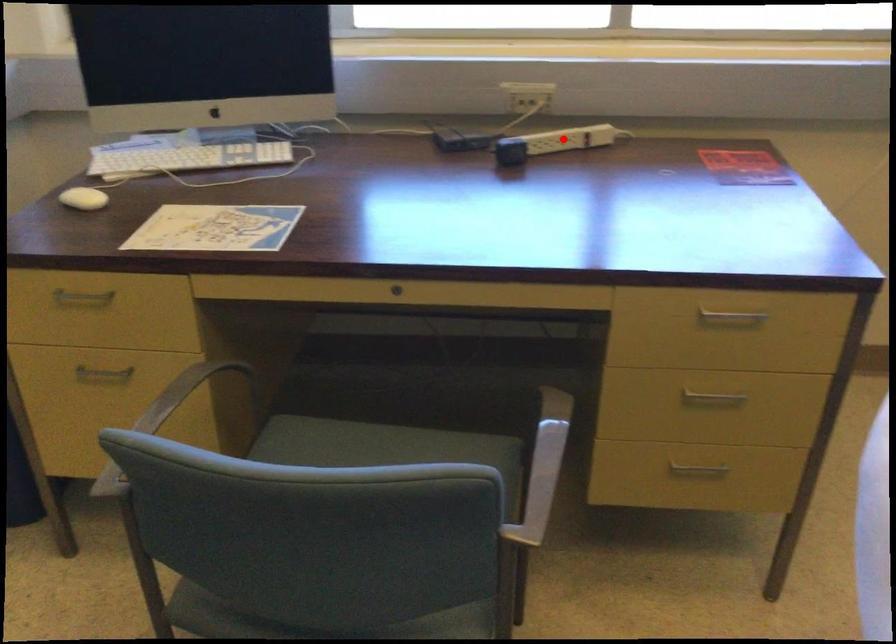
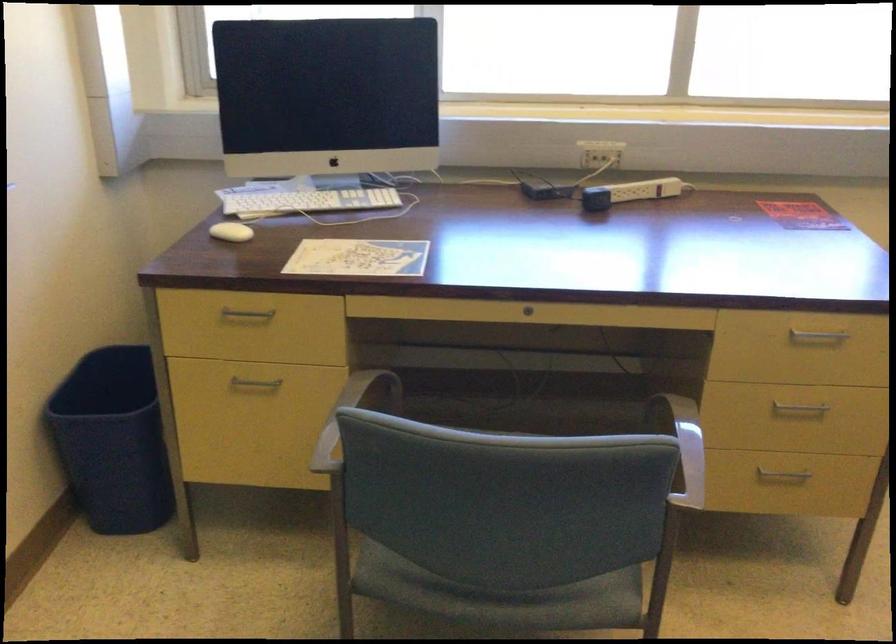
Question: A red point is marked in image1. In image2, is the corresponding 3D point closer to the camera or farther? Reply with the corresponding letter.

Choices:
 (A) The corresponding 3D point is closer.
 (B) The corresponding 3D point is farther.

Answer: (B)